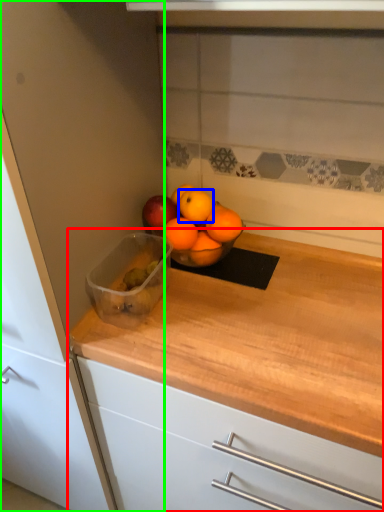
Question: Estimate the real-world distances between objects in this image. Which object is farther from countertop (highlighted by a red box), orange (highlighted by a blue box) or cabinetry (highlighted by a green box)?

Choices:
 (A) orange
 (B) cabinetry

Answer: (A)